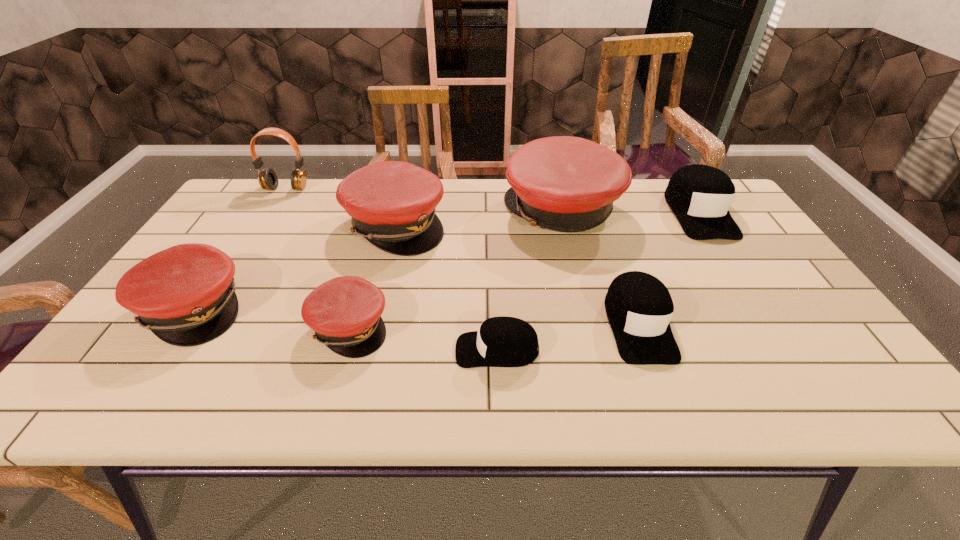
The height and width of the screenshot is (540, 960). Find the location of `object located at the far right corner`. object located at the far right corner is located at coordinates (699, 195).

In the image, there is a desktop. At what (x,y) coordinates should I click in order to perform the action: click on vacant space at the far edge. Please return your answer as a coordinate pair (x, y). The image size is (960, 540). Looking at the image, I should click on (321, 213).

Locate an element on the screen. The height and width of the screenshot is (540, 960). free space at the near edge of the desktop is located at coordinates (330, 377).

Image resolution: width=960 pixels, height=540 pixels. Identify the location of vacant space at the left edge of the desktop. (173, 359).

You are a GUI agent. You are given a task and a screenshot of the screen. Output one action in this format:
    pyautogui.click(x=<x>, y=<y>)
    Task: Click on the vacant space at the right edge
    
    Given the screenshot: What is the action you would take?
    pyautogui.click(x=770, y=275)

Image resolution: width=960 pixels, height=540 pixels. In the image, there is a desktop. What are the coordinates of `free region at the far left corner` in the screenshot? It's located at (241, 215).

At what (x,y) coordinates should I click in order to perform the action: click on vacant area between the shortest object and the second biggest red cap. Please return your answer as a coordinate pair (x, y). Looking at the image, I should click on (446, 287).

Image resolution: width=960 pixels, height=540 pixels. Identify the location of vacant space that's between the second black cap from right to left and the second biggest red cap. (516, 275).

I want to click on free spot between the shortest object and the smallest red cap, so click(423, 339).

Where is `free space between the tallest cap and the shortest cap`? This screenshot has height=540, width=960. free space between the tallest cap and the shortest cap is located at coordinates (530, 280).